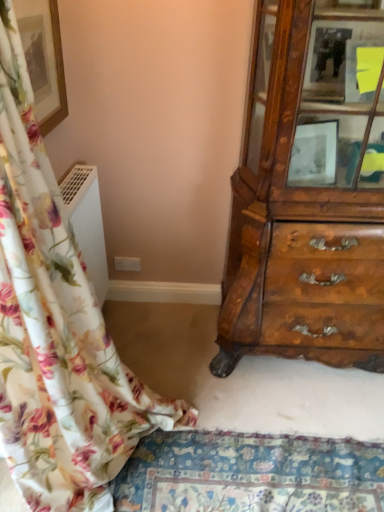
Question: Does wooden cabinet at right lie in front of floral fabric curtain at left?

Choices:
 (A) no
 (B) yes

Answer: (A)

Question: Is wooden cabinet at right outside of floral fabric curtain at left?

Choices:
 (A) no
 (B) yes

Answer: (B)

Question: Is wooden cabinet at right next to floral fabric curtain at left?

Choices:
 (A) yes
 (B) no

Answer: (B)

Question: From the image's perspective, is wooden cabinet at right under floral fabric curtain at left?

Choices:
 (A) yes
 (B) no

Answer: (B)

Question: Can you confirm if wooden cabinet at right is bigger than floral fabric curtain at left?

Choices:
 (A) no
 (B) yes

Answer: (B)

Question: From a real-world perspective, relative to floral fabric mat at lower center, is matte gold picture frame at upper left vertically above or below?

Choices:
 (A) above
 (B) below

Answer: (A)

Question: From their relative heights in the image, would you say matte gold picture frame at upper left is taller or shorter than floral fabric mat at lower center?

Choices:
 (A) tall
 (B) short

Answer: (A)

Question: Which is correct: matte gold picture frame at upper left is inside floral fabric mat at lower center, or outside of it?

Choices:
 (A) outside
 (B) inside

Answer: (A)

Question: Considering the relative positions of matte gold picture frame at upper left and floral fabric mat at lower center in the image provided, is matte gold picture frame at upper left to the left or to the right of floral fabric mat at lower center?

Choices:
 (A) left
 (B) right

Answer: (A)

Question: Considering the positions of point (352, 162) and point (316, 471), is point (352, 162) closer or farther from the camera than point (316, 471)?

Choices:
 (A) farther
 (B) closer

Answer: (A)

Question: In terms of height, does wooden cabinet at right look taller or shorter compared to floral fabric mat at lower center?

Choices:
 (A) short
 (B) tall

Answer: (B)

Question: Which is correct: wooden cabinet at right is inside floral fabric mat at lower center, or outside of it?

Choices:
 (A) outside
 (B) inside

Answer: (A)

Question: Is wooden cabinet at right to the left or to the right of floral fabric mat at lower center in the image?

Choices:
 (A) right
 (B) left

Answer: (A)

Question: Is point (29, 7) closer or farther from the camera than point (0, 354)?

Choices:
 (A) farther
 (B) closer

Answer: (A)

Question: From their relative heights in the image, would you say matte gold picture frame at upper left is taller or shorter than floral fabric curtain at left?

Choices:
 (A) short
 (B) tall

Answer: (A)